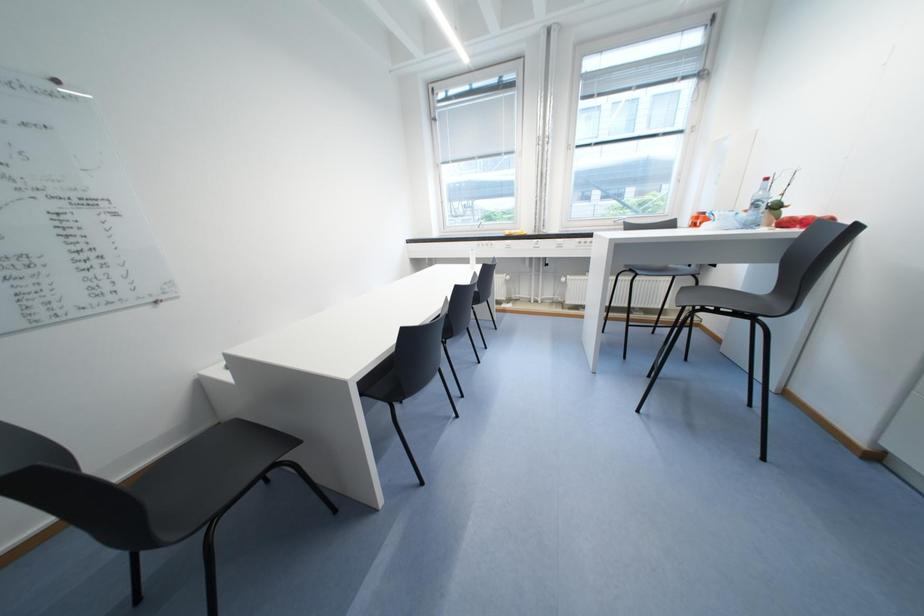
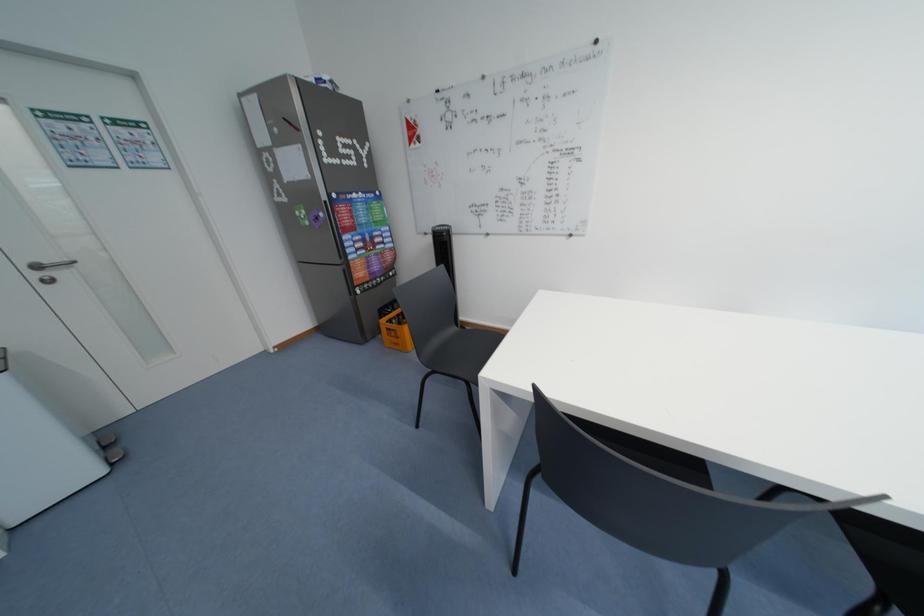
How did the camera likely rotate?

The camera rotated toward left-down.